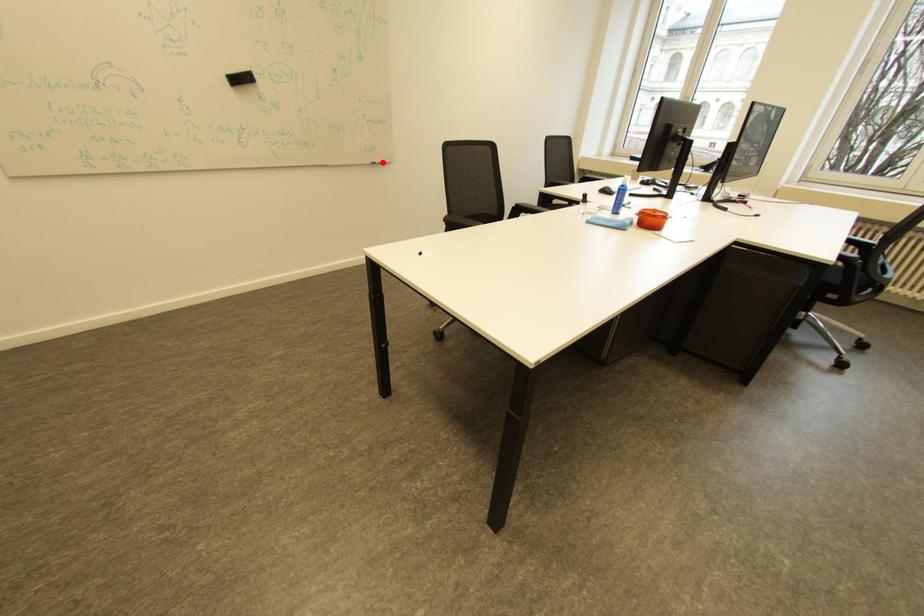
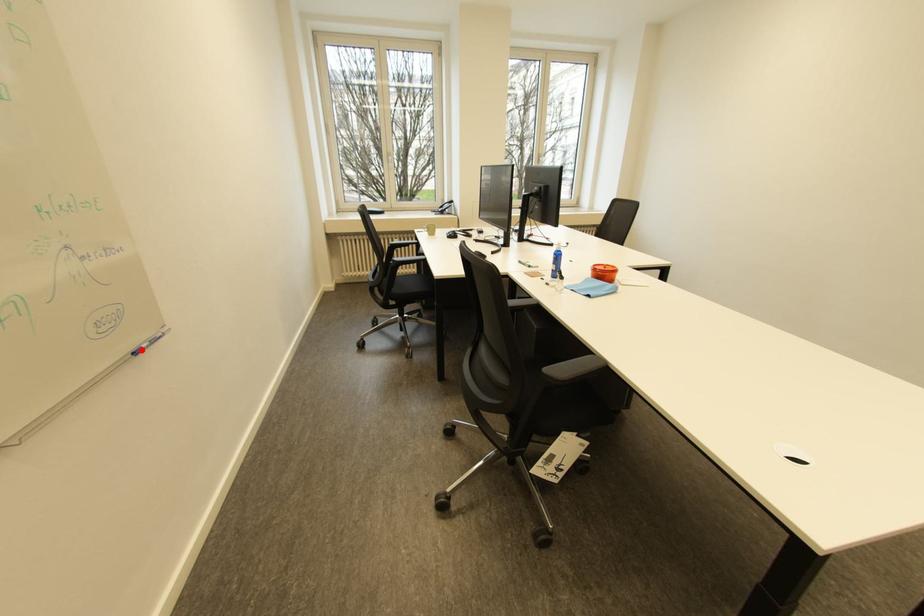
I am providing you with two images of the same scene from different viewpoints. A red point is marked on the first image and another point is marked on the second image. Is the red point in image1 aligned with the point shown in image2?

Yes